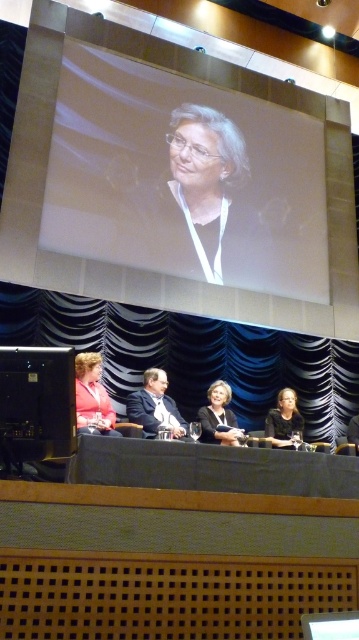
Question: Does black fabric table at lower center have a smaller size compared to matte black hair at lower right?

Choices:
 (A) no
 (B) yes

Answer: (A)

Question: Can you confirm if black fabric table at lower center is positioned to the right of matte pink shirt at lower left?

Choices:
 (A) no
 (B) yes

Answer: (B)

Question: Which of the following is the farthest from the observer?

Choices:
 (A) (81, 364)
 (B) (170, 412)
 (C) (145, 93)

Answer: (C)

Question: Among these objects, which one is farthest from the camera?

Choices:
 (A) matte black jacket at center
 (B) white glossy screen at upper center

Answer: (B)

Question: Which object is the closest to the matte pink shirt at lower left?

Choices:
 (A) matte black hair at lower right
 (B) white glossy screen at upper center

Answer: (A)

Question: Can you confirm if white glossy screen at upper center is wider than matte black hair at lower right?

Choices:
 (A) yes
 (B) no

Answer: (A)